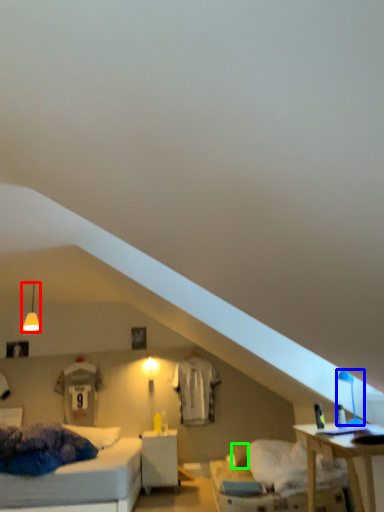
Question: Which object is positioned closest to fixture (highlighted by a red box)? Select from table lamp (highlighted by a blue box) and pillow (highlighted by a green box).

Choices:
 (A) table lamp
 (B) pillow

Answer: (B)